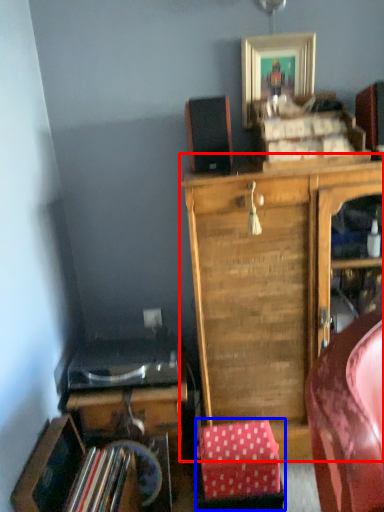
Question: Which object is closer to the camera taking this photo, cabinetry (highlighted by a red box) or stool (highlighted by a blue box)?

Choices:
 (A) cabinetry
 (B) stool

Answer: (A)